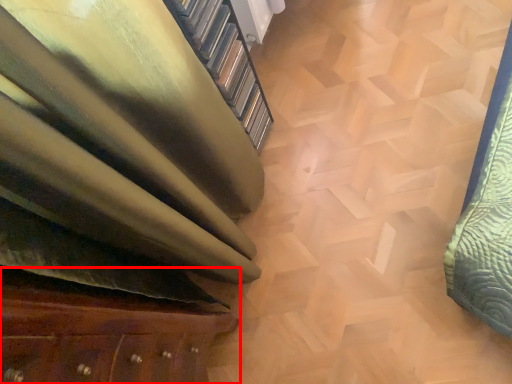
Question: From the image's perspective, where is furniture (annotated by the red box) located relative to stairwell?

Choices:
 (A) above
 (B) below

Answer: (B)